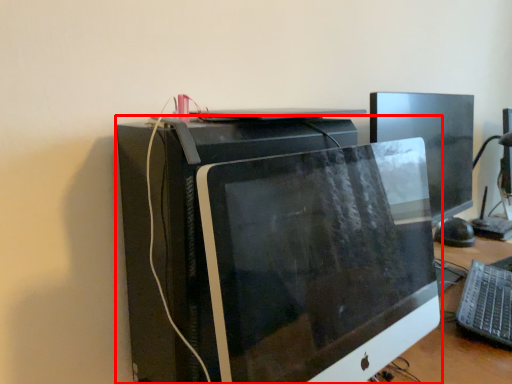
Question: From the image's perspective, where is computer monitor (annotated by the red box) located in relation to computer keyboard in the image?

Choices:
 (A) above
 (B) below

Answer: (A)